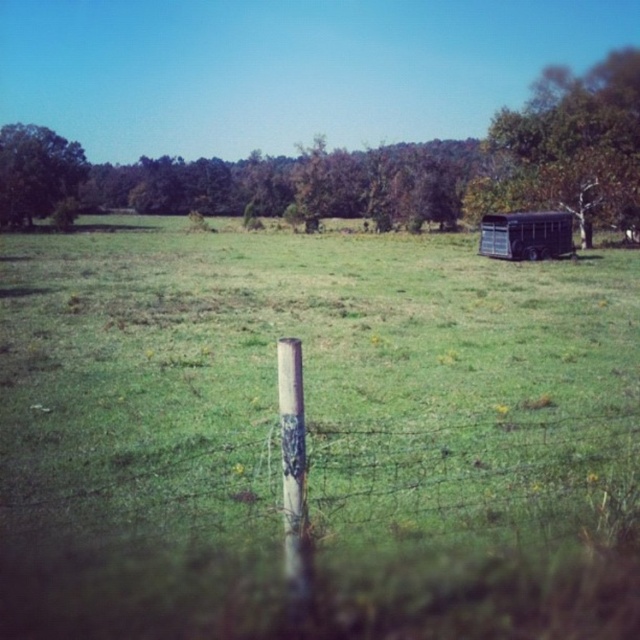
You are a photographer setting up a tripod in the middle of the grassy field. You want to frame both the wooden post at center and the green leafy tree at upper right in your shot. Which object will appear larger in your photo?

The wooden post at center appears smaller than the green leafy tree at upper right in the photo because it is physically smaller, so the green leafy tree at upper right will look larger.

You are a photographer standing in the field and want to take a picture of the wooden post at center and the metallic trailer at right. Based on their positions, which object would appear closer to the camera in the photo?

The wooden post at center appears closer to the camera because it is positioned below the metallic trailer at right, indicating it is in the foreground.